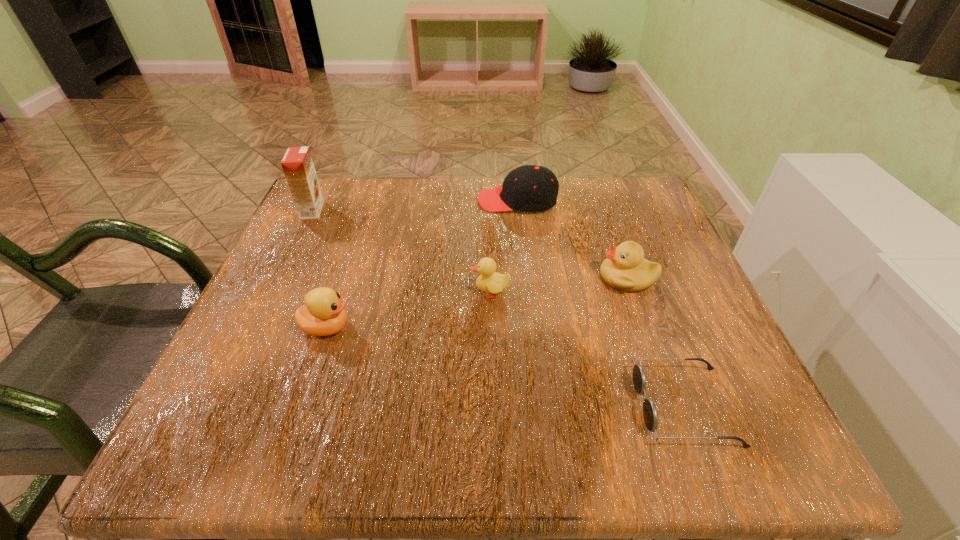
At what (x,y) coordinates should I click in order to perform the action: click on free point located 0.280m on the front-facing side of the nearest object. Please return your answer as a coordinate pair (x, y). The image size is (960, 540). Looking at the image, I should click on (451, 406).

Locate an element on the screen. free space located on the front-facing side of the nearest object is located at coordinates (564, 406).

The image size is (960, 540). I want to click on free spot located on the front-facing side of the nearest object, so click(551, 406).

This screenshot has height=540, width=960. Identify the location of orange juice present at the far edge. (297, 164).

The image size is (960, 540). In order to click on cap located at the far edge in this screenshot , I will do `click(530, 188)`.

This screenshot has height=540, width=960. I want to click on object located in the near edge section of the desktop, so click(650, 415).

Find the location of `orange juice that is at the left edge`. orange juice that is at the left edge is located at coordinates (297, 164).

At what (x,y) coordinates should I click in order to perform the action: click on duckling present at the left edge. Please return your answer as a coordinate pair (x, y). The height and width of the screenshot is (540, 960). Looking at the image, I should click on (323, 314).

Find the location of a particular element. duckling present at the right edge is located at coordinates (625, 268).

Locate an element on the screen. sunglasses that is at the right edge is located at coordinates (650, 415).